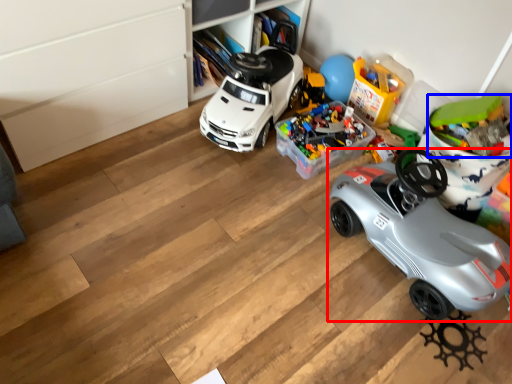
Question: Which point is closer to the camera, car (highlighted by a red box) or toy (highlighted by a blue box)?

Choices:
 (A) car
 (B) toy

Answer: (A)